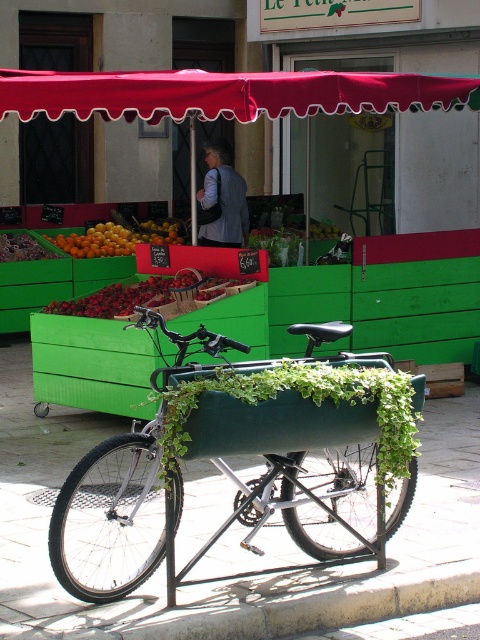
Question: Is green matte bicycle at center behind red fabric canopy at upper center?

Choices:
 (A) no
 (B) yes

Answer: (A)

Question: Does shiny red strawberries at center have a greater width compared to orange matte fruit at left?

Choices:
 (A) yes
 (B) no

Answer: (A)

Question: Which point is farther from the camera taking this photo?

Choices:
 (A) (386, 472)
 (B) (476, 76)

Answer: (B)

Question: Which of these objects is positioned closest to the orange matte fruit at left?

Choices:
 (A) red fabric canopy at upper center
 (B) shiny red strawberries at center

Answer: (B)

Question: Which point is farther from the camera taking this photo?

Choices:
 (A) (98, 236)
 (B) (400, 384)
 (C) (132, 83)

Answer: (A)

Question: In this image, where is green matte bicycle at center located relative to orange matte fruit at left?

Choices:
 (A) above
 (B) below

Answer: (B)